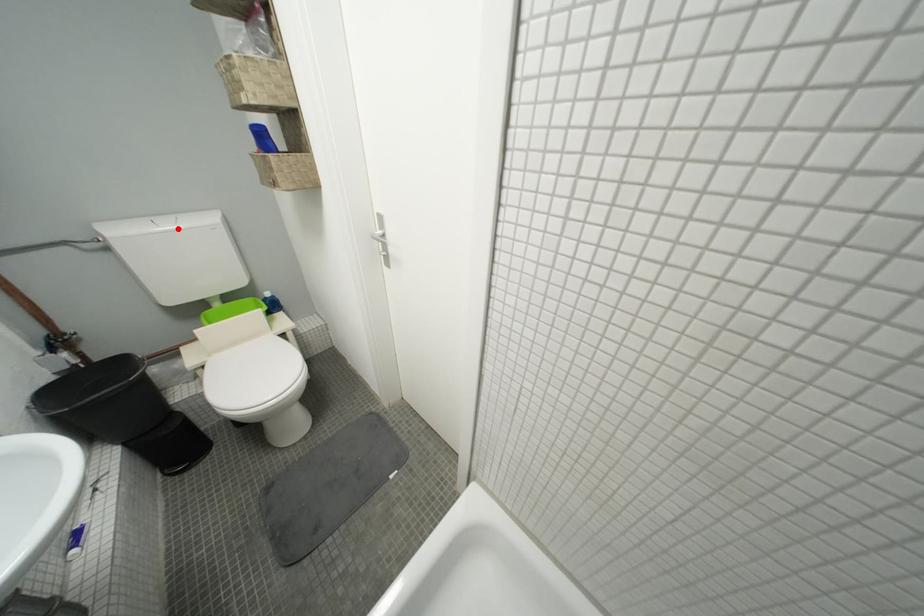
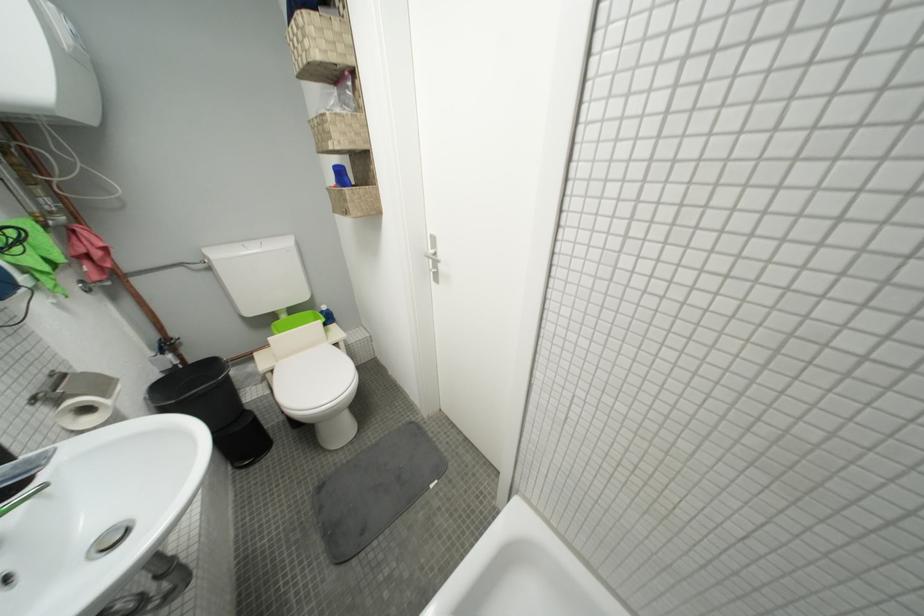
Where in the second image is the point corresponding to the highlighted location from the first image?

(262, 252)